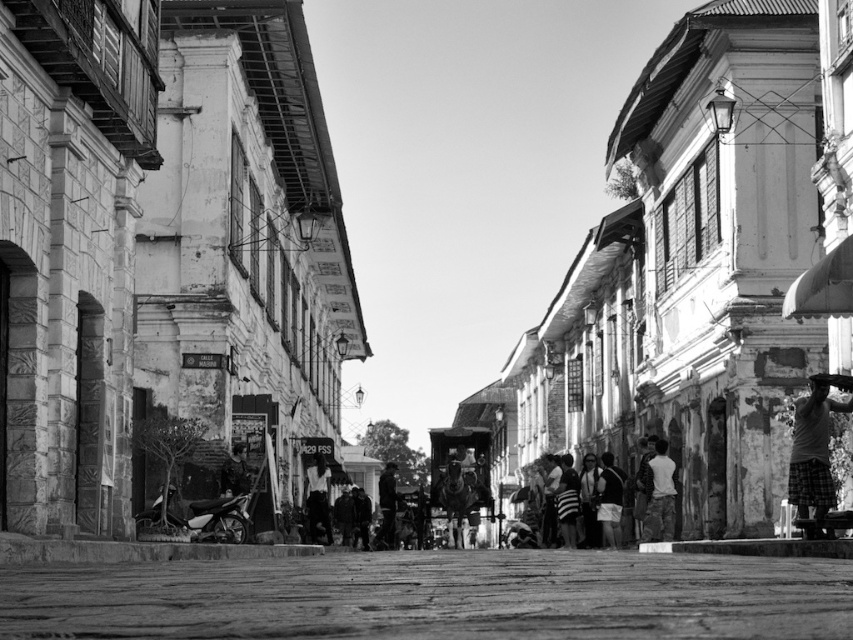
Does plaid fabric skateboarder at right have a greater height compared to light gray fabric shirt at lower right?

Yes.

Does plaid fabric skateboarder at right appear on the right side of light gray fabric shirt at lower right?

Correct, you'll find plaid fabric skateboarder at right to the right of light gray fabric shirt at lower right.

Find the location of a particular element. This screenshot has height=640, width=853. plaid fabric skateboarder at right is located at coordinates (814, 451).

In order to click on plaid fabric skateboarder at right in this screenshot , I will do 814,451.

Does smooth concrete alley at center have a greater width compared to light gray fabric shirt at lower right?

Yes.

Does point (3, 588) lie in front of point (647, 486)?

Yes, it is.

Identify the location of smooth concrete alley at center. This screenshot has width=853, height=640. (434, 596).

Between point (579, 584) and point (793, 458), which one is positioned in front?

Point (579, 584) is more forward.

Which is more to the right, smooth concrete alley at center or plaid fabric skateboarder at right?

plaid fabric skateboarder at right

Identify the location of smooth concrete alley at center. (434, 596).